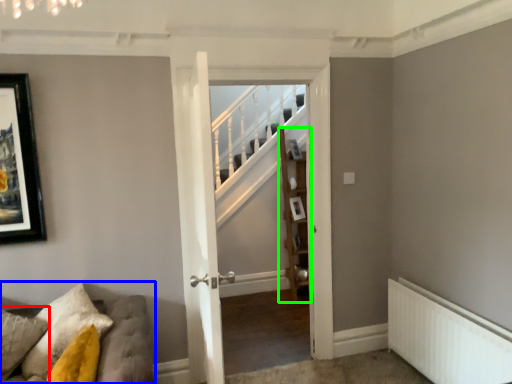
Question: Which is farther away from pillow (highlighted by a red box)? furniture (highlighted by a blue box) or shelf (highlighted by a green box)?

Choices:
 (A) furniture
 (B) shelf

Answer: (B)